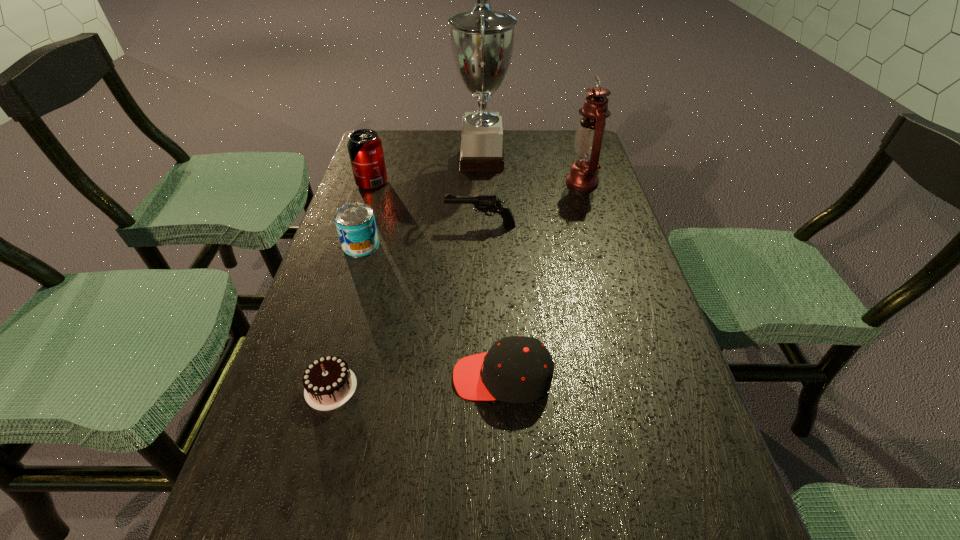
In order to click on free space that is in between the cap and the trophy cup in this screenshot , I will do `click(492, 268)`.

This screenshot has width=960, height=540. In order to click on vacant area that lies between the rightmost object and the tallest object in this screenshot , I will do `click(532, 171)`.

Locate an element on the screen. vacant region between the gun and the tallest object is located at coordinates (481, 193).

Find the location of a particular element. unoccupied area between the shortest object and the tallest object is located at coordinates (406, 274).

Find the location of a particular element. free space between the third nearest object and the tallest object is located at coordinates (421, 202).

Locate an element on the screen. This screenshot has height=540, width=960. empty location between the rightmost object and the fifth shortest object is located at coordinates (477, 183).

The height and width of the screenshot is (540, 960). Find the location of `free space between the cap and the chocolate cake`. free space between the cap and the chocolate cake is located at coordinates (417, 382).

I want to click on the fifth closest object to the second tallest object, so click(517, 369).

I want to click on the closest object to the gun, so click(x=355, y=222).

The height and width of the screenshot is (540, 960). I want to click on free space that satisfies the following two spatial constraints: 1. at the front view of the sixth shortest object; 2. on the left side of the trophy cup, so click(482, 182).